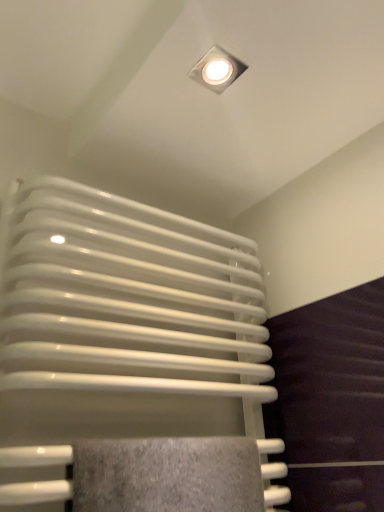
Question: Is white glossy square lamp at upper center wider or thinner than white glossy radiator at center?

Choices:
 (A) thin
 (B) wide

Answer: (A)

Question: Would you say white glossy square lamp at upper center is to the left or to the right of white glossy radiator at center in the picture?

Choices:
 (A) right
 (B) left

Answer: (A)

Question: Is point [x=200, y=69] closer or farther from the camera than point [x=230, y=285]?

Choices:
 (A) farther
 (B) closer

Answer: (B)

Question: From a real-world perspective, is white glossy radiator at center physically located above or below white glossy square lamp at upper center?

Choices:
 (A) below
 (B) above

Answer: (A)

Question: From the image's perspective, is white glossy radiator at center positioned above or below white glossy square lamp at upper center?

Choices:
 (A) above
 (B) below

Answer: (B)

Question: Considering the positions of white glossy radiator at center and white glossy square lamp at upper center in the image, is white glossy radiator at center bigger or smaller than white glossy square lamp at upper center?

Choices:
 (A) big
 (B) small

Answer: (A)

Question: Considering the positions of white glossy radiator at center and white glossy square lamp at upper center in the image, is white glossy radiator at center taller or shorter than white glossy square lamp at upper center?

Choices:
 (A) short
 (B) tall

Answer: (B)